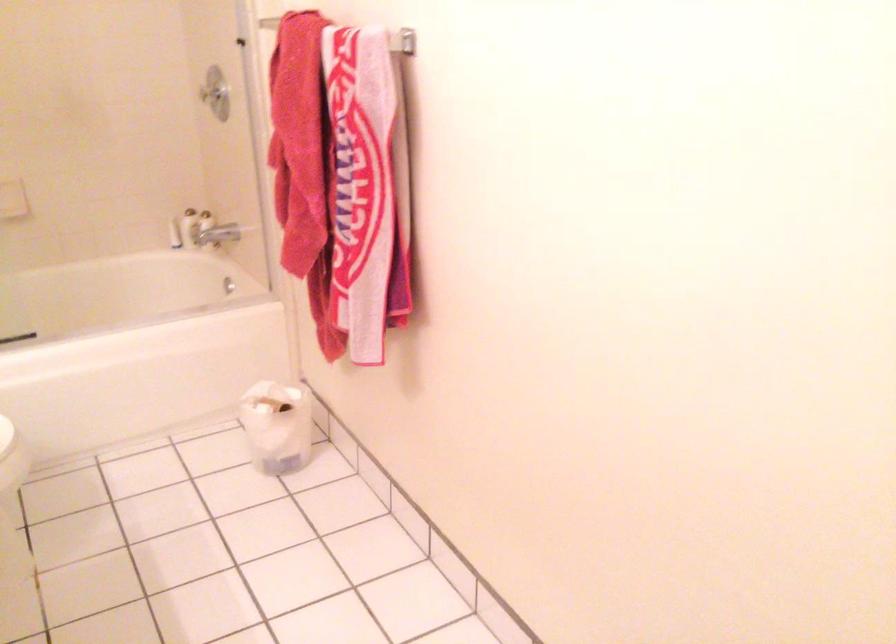
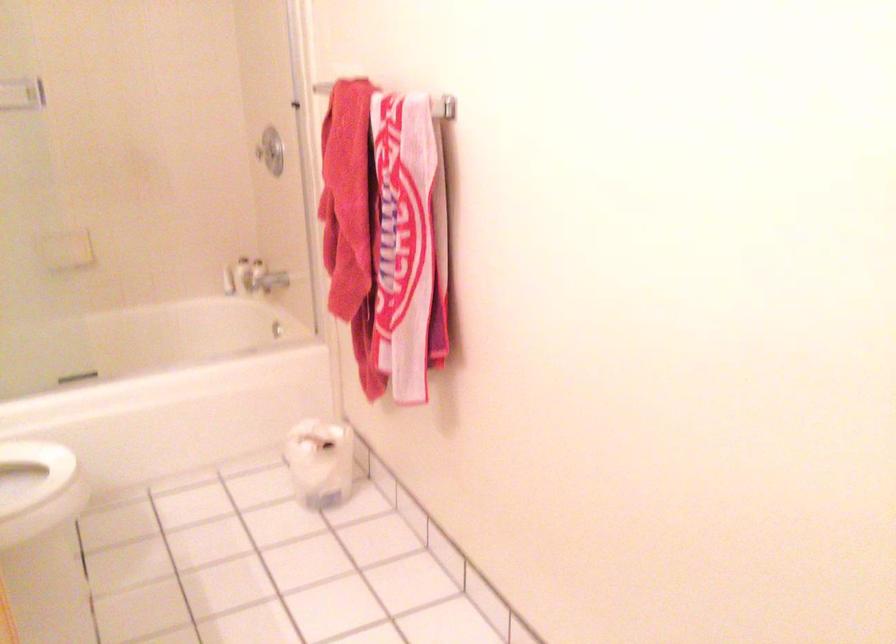
Question: In a continuous first-person perspective shot, in which direction is the camera moving?

Choices:
 (A) Left
 (B) Right
 (C) Forward
 (D) Backward

Answer: (D)